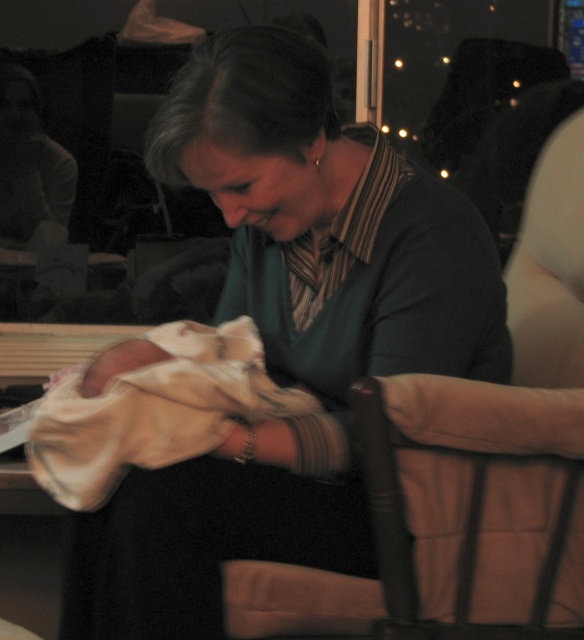
Question: Which point is closer to the camera?

Choices:
 (A) (241, 573)
 (B) (92, 452)

Answer: (B)

Question: In this image, where is brown fabric armchair at center located relative to soft white blanket at center?

Choices:
 (A) right
 (B) left

Answer: (A)

Question: Is brown fabric armchair at center to the right of soft white blanket at center from the viewer's perspective?

Choices:
 (A) yes
 (B) no

Answer: (A)

Question: Which point is closer to the camera taking this photo?

Choices:
 (A) 538,179
 (B) 213,353

Answer: (B)

Question: Among these points, which one is nearest to the camera?

Choices:
 (A) (252, 388)
 (B) (517, 236)

Answer: (A)

Question: Does brown fabric armchair at center have a larger size compared to soft white blanket at center?

Choices:
 (A) no
 (B) yes

Answer: (A)